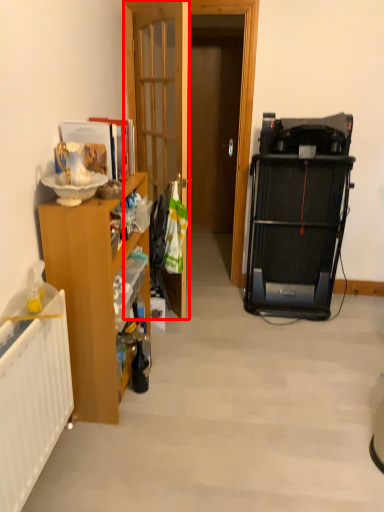
Question: From the image's perspective, what is the correct spatial positioning of door (annotated by the red box) in reference to cabinetry?

Choices:
 (A) below
 (B) above

Answer: (B)